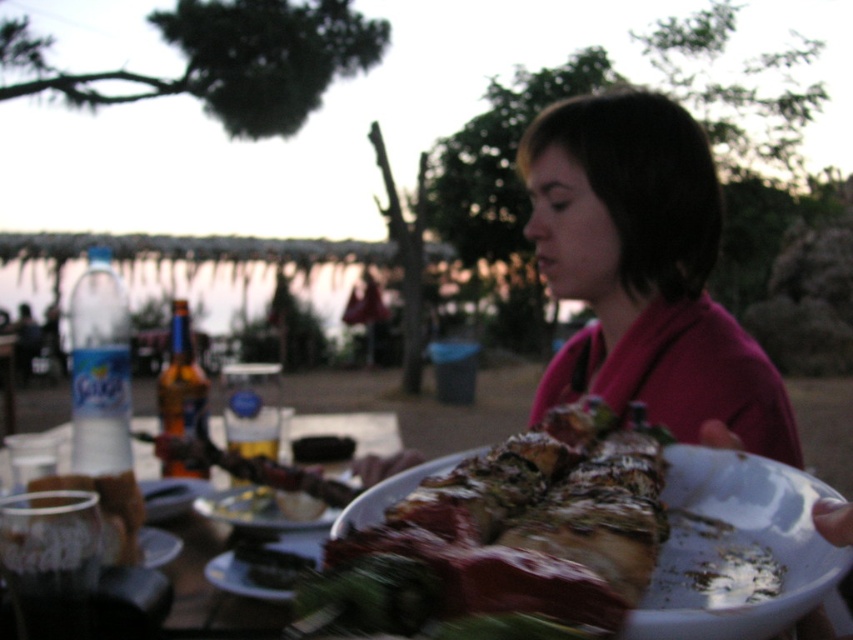
Does white glossy plate at center appear under translucent glass cup at lower left?

Correct, white glossy plate at center is located below translucent glass cup at lower left.

Between point (30, 444) and point (105, 528), which one is positioned in front?

Positioned in front is point (105, 528).

Locate an element on the screen. This screenshot has height=640, width=853. white glossy plate at center is located at coordinates (349, 428).

How much distance is there between pink fabric at center and translucent glass cup at lower left?

They are 20.82 inches apart.

Is pink fabric at center taller than translucent glass cup at lower left?

Correct, pink fabric at center is much taller as translucent glass cup at lower left.

Identify the location of pink fabric at center. (643, 272).

Can you confirm if shiny metallic roast at center is positioned below translucent glass cup at lower left?

Actually, shiny metallic roast at center is above translucent glass cup at lower left.

Who is more distant from viewer, (x=425, y=532) or (x=135, y=534)?

Point (x=135, y=534)

Locate an element on the screen. shiny metallic roast at center is located at coordinates (509, 532).